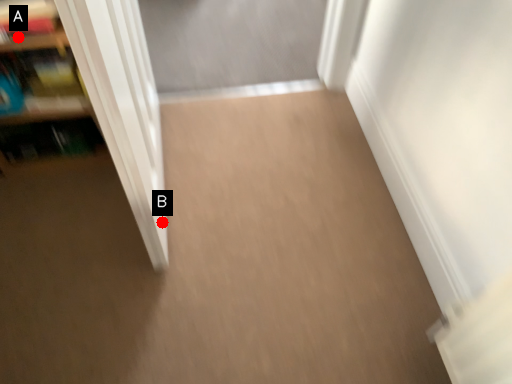
Question: Two points are circled on the image, labeled by A and B beside each circle. Which of the following is the closest to the observer?

Choices:
 (A) A is closer
 (B) B is closer

Answer: (A)